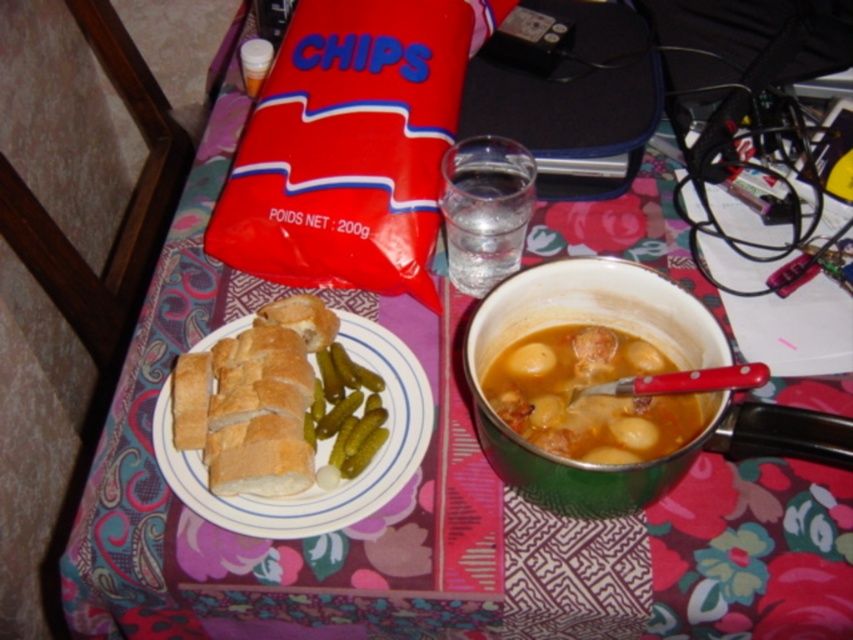
Question: Which point is closer to the camera taking this photo?

Choices:
 (A) (531, 330)
 (B) (579, 403)

Answer: (B)

Question: Can you confirm if green enamel bowl at center is bigger than white ceramic plate at center?

Choices:
 (A) yes
 (B) no

Answer: (A)

Question: Which point is closer to the camera taking this photo?

Choices:
 (A) (444, 209)
 (B) (566, 376)

Answer: (B)

Question: Can you confirm if white ceramic plate at center is wider than clear glass water at center?

Choices:
 (A) no
 (B) yes

Answer: (B)

Question: Observing the image, what is the correct spatial positioning of brown matte stew at center in reference to white ceramic plate at center?

Choices:
 (A) above
 (B) below

Answer: (A)

Question: Among these points, which one is farthest from the camera?

Choices:
 (A) (537, 328)
 (B) (465, 284)
 (C) (379, 362)

Answer: (B)